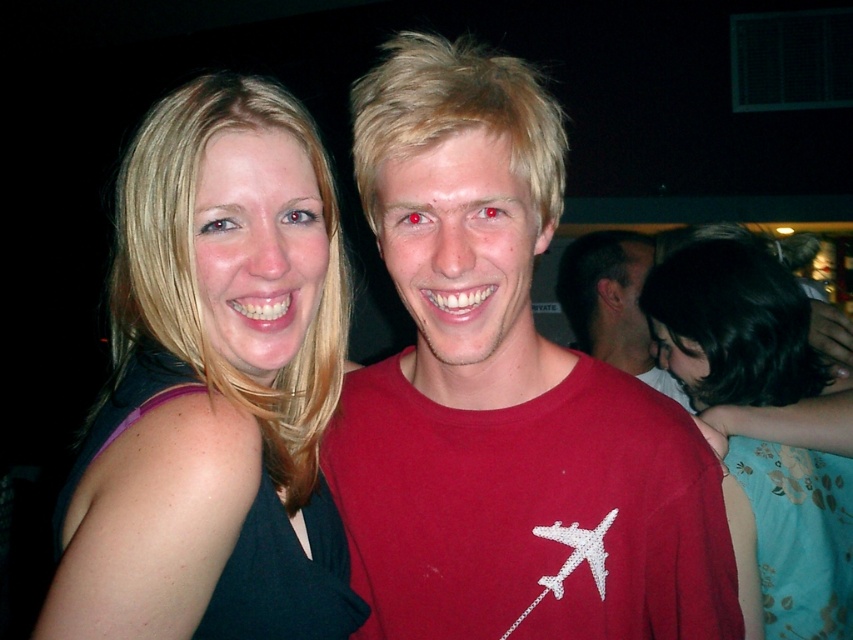
Which is in front, point (544, 186) or point (645, 301)?

Point (544, 186)

Is red matte shirt at center taller than floral fabric dress at right?

No.

Which is in front, point (524, 106) or point (756, 460)?

Point (524, 106) is in front.

Image resolution: width=853 pixels, height=640 pixels. I want to click on red matte shirt at center, so click(503, 396).

Is point (318, 592) closer to camera compared to point (584, 257)?

Yes, point (318, 592) is in front of point (584, 257).

Based on the photo, does matte black dress at left appear on the left side of matte red t-shirt at center?

Indeed, matte black dress at left is positioned on the left side of matte red t-shirt at center.

Between point (277, 129) and point (636, 284), which one is positioned in front?

Point (277, 129)

Locate an element on the screen. matte black dress at left is located at coordinates (213, 387).

Does red matte shirt at center have a larger size compared to matte red t-shirt at center?

Actually, red matte shirt at center might be smaller than matte red t-shirt at center.

Which of these two, red matte shirt at center or matte red t-shirt at center, stands shorter?

With less height is matte red t-shirt at center.

The image size is (853, 640). Describe the element at coordinates (503, 396) in the screenshot. I see `red matte shirt at center` at that location.

I want to click on red matte shirt at center, so click(503, 396).